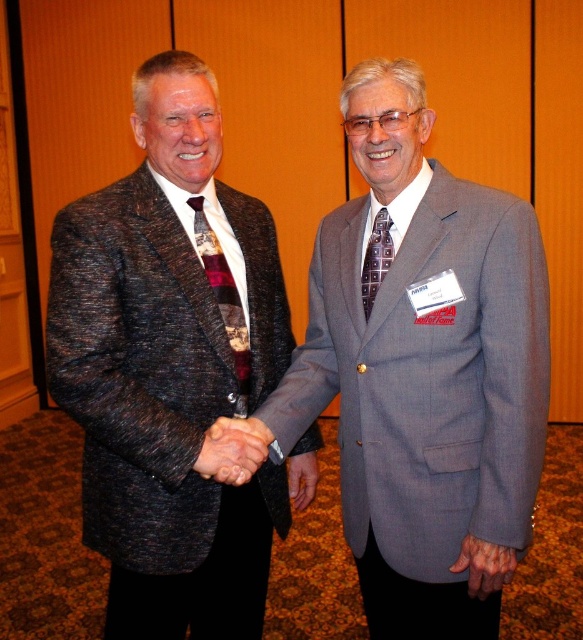
Does smooth skin hand at center appear over smooth leather hand at center?

Correct, smooth skin hand at center is located above smooth leather hand at center.

Measure the distance between point (222,451) and camera.

Point (222,451) is 1.30 meters away from camera.

Is point (205, 460) less distant than point (310, 480)?

Yes.

Locate an element on the screen. smooth skin hand at center is located at coordinates (233, 449).

Measure the distance between point (220,269) and camera.

4.80 feet

Is point (237, 376) farther from viewer compared to point (303, 492)?

No, it is in front of (303, 492).

Find the location of `plaid fabric tie at center`. plaid fabric tie at center is located at coordinates (223, 296).

Who is more forward, (138,337) or (199,458)?

Point (199,458)

Is textured wool blazer at center bigger than smooth skin hand at center?

Yes, textured wool blazer at center is bigger than smooth skin hand at center.

Where is `textured wool blazer at center`? Image resolution: width=583 pixels, height=640 pixels. textured wool blazer at center is located at coordinates (170, 368).